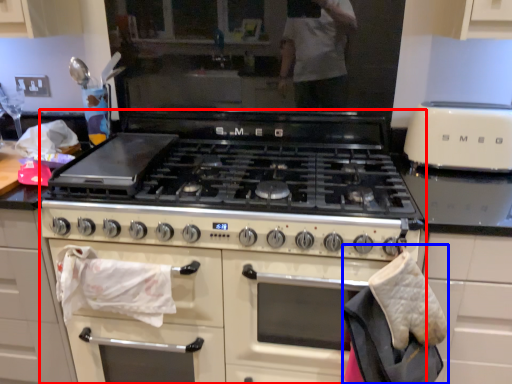
Question: Which point is closer to the camera, appliance (highlighted by a red box) or material (highlighted by a blue box)?

Choices:
 (A) appliance
 (B) material

Answer: (B)